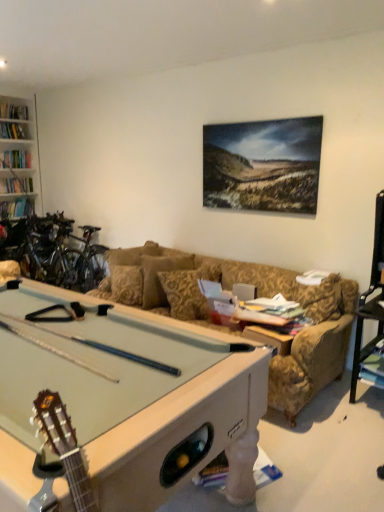
Question: Is point (178, 281) positioned closer to the camera than point (170, 342)?

Choices:
 (A) farther
 (B) closer

Answer: (A)

Question: Is gold floral-patterned pillow at center wider or thinner than light green felt pool table at lower left?

Choices:
 (A) wide
 (B) thin

Answer: (B)

Question: Which object is the closest to the gold floral-patterned pillow at center?

Choices:
 (A) shiny metallic bicycles at left
 (B) light green felt pool table at lower left

Answer: (B)

Question: Which object is the closest to the light green felt pool table at lower left?

Choices:
 (A) shiny metallic bicycles at left
 (B) gold floral-patterned pillow at center

Answer: (B)